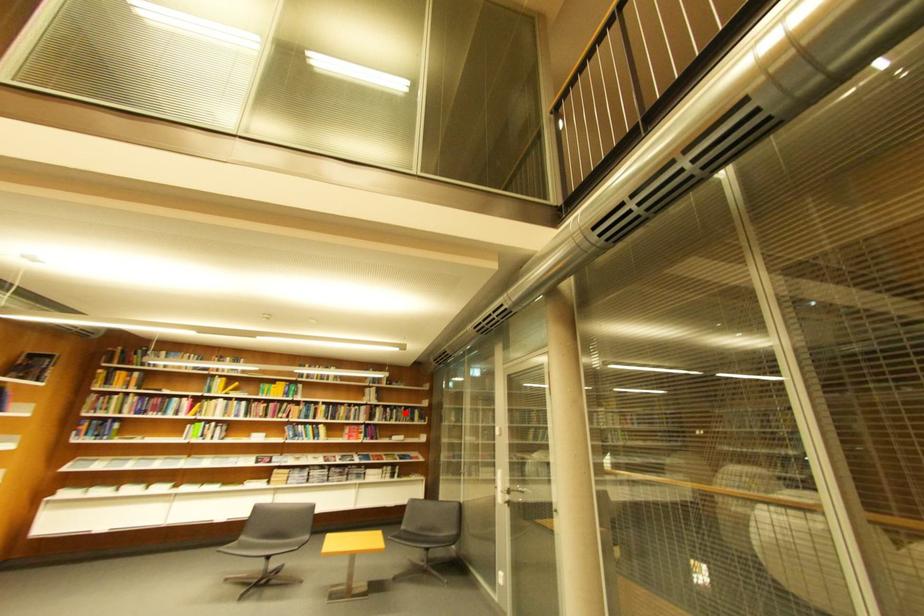
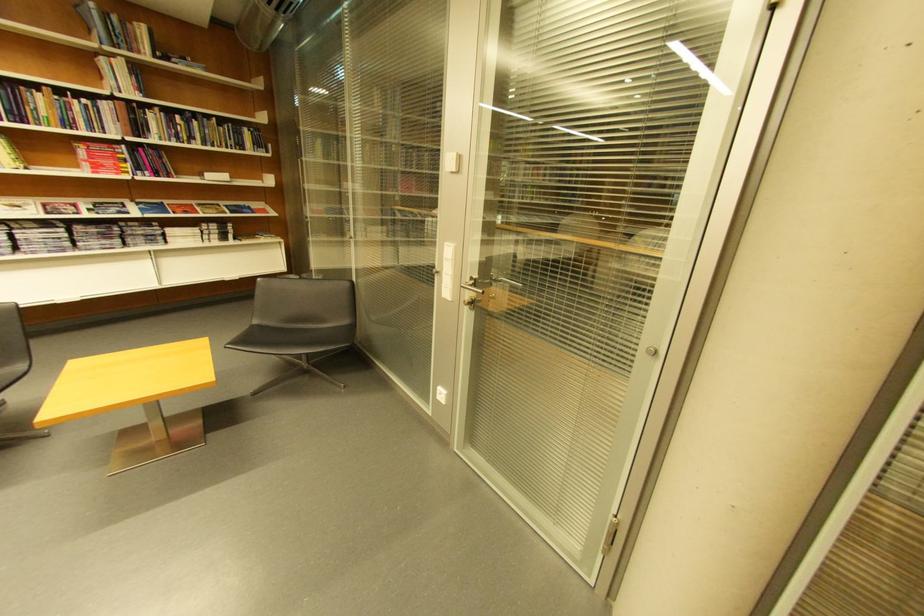
Question: I am providing you with two images of the same scene from different viewpoints. A red point is marked on the first image. Can you still see the location of the red point in image 2?

Choices:
 (A) Yes
 (B) No

Answer: (A)